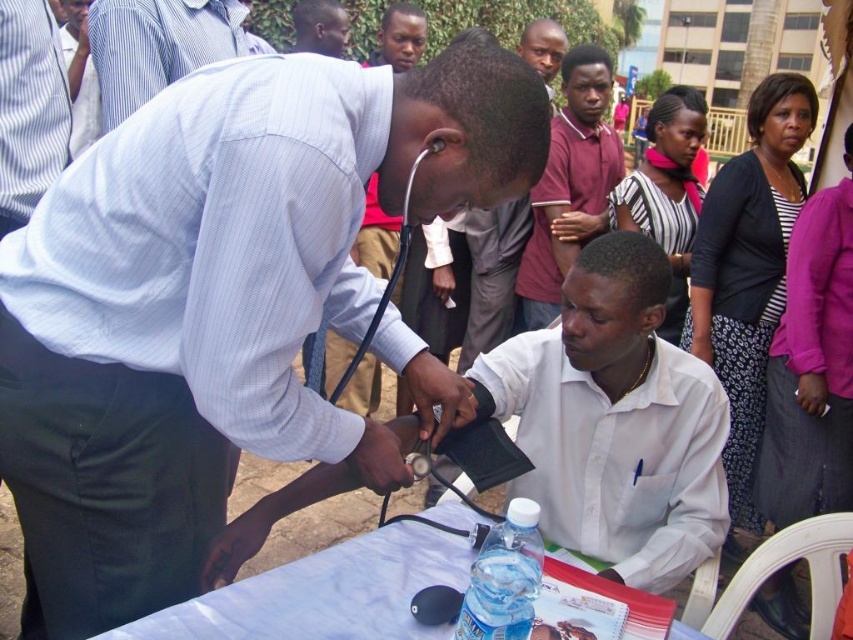
Question: Observing the image, what is the correct spatial positioning of white matte shirt at center in reference to matte red shirt at center?

Choices:
 (A) below
 (B) above

Answer: (A)

Question: Does white striped shirt at upper left have a lesser width compared to translucent plastic water bottle at center?

Choices:
 (A) no
 (B) yes

Answer: (B)

Question: Is matte white shirt at center further to camera compared to white matte shirt at center?

Choices:
 (A) no
 (B) yes

Answer: (A)

Question: Estimate the real-world distances between objects in this image. Which object is farther from the translucent plastic water bottle at center?

Choices:
 (A) matte red shirt at center
 (B) light blue striped shirt at upper left

Answer: (A)

Question: Which object is the farthest from the white striped shirt at upper left?

Choices:
 (A) white matte shirt at center
 (B) matte red shirt at center

Answer: (B)

Question: Which point appears closest to the camera in this image?

Choices:
 (A) (589, 528)
 (B) (286, 620)

Answer: (B)